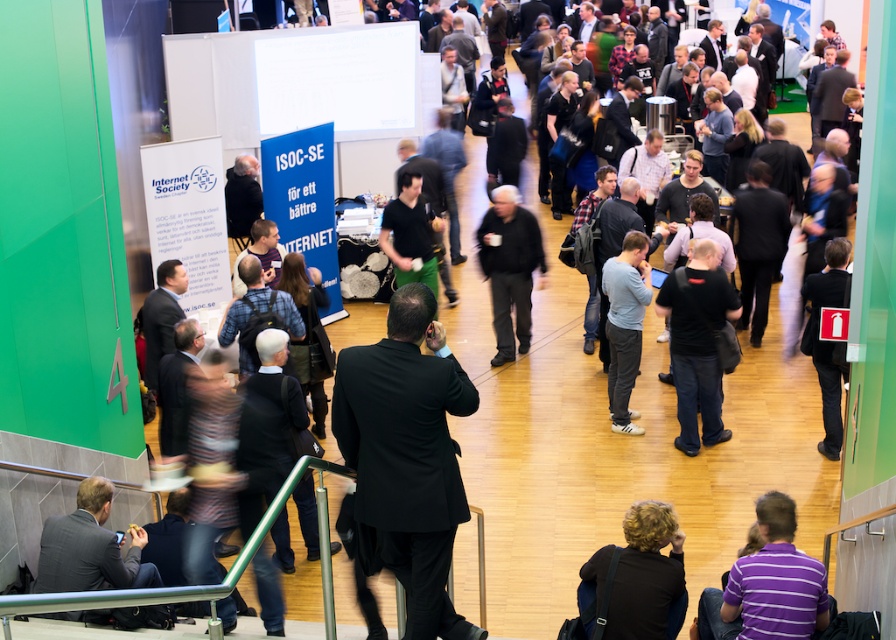
Question: Which point is farther to the camera?

Choices:
 (A) (791, 600)
 (B) (626, 305)

Answer: (B)

Question: Which object is positioned closest to the gray matte shirt at center?

Choices:
 (A) dark suit at lower left
 (B) black matte jacket at center
 (C) black suit at center

Answer: (B)

Question: Can you confirm if purple striped shirt at lower right is smaller than blonde hair at lower center?

Choices:
 (A) no
 (B) yes

Answer: (A)

Question: Can you confirm if black matte shirt at center is bigger than gray matte shirt at center?

Choices:
 (A) yes
 (B) no

Answer: (A)

Question: Is black suit at center below black matte jacket at center?

Choices:
 (A) no
 (B) yes

Answer: (B)

Question: Which of the following is the closest to the observer?

Choices:
 (A) purple striped shirt at lower right
 (B) black matte jacket at center
 (C) dark suit at lower left

Answer: (A)